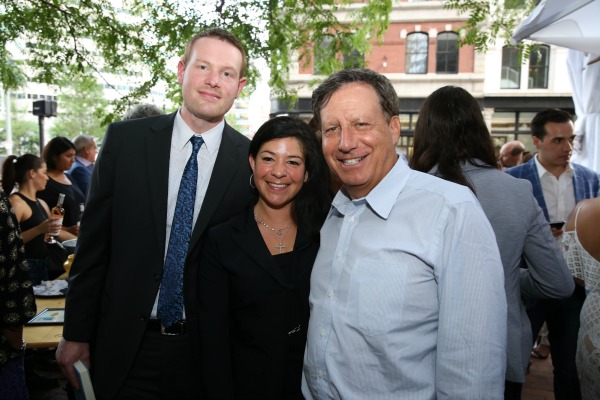
Find the location of a particular element. table is located at coordinates (46, 335).